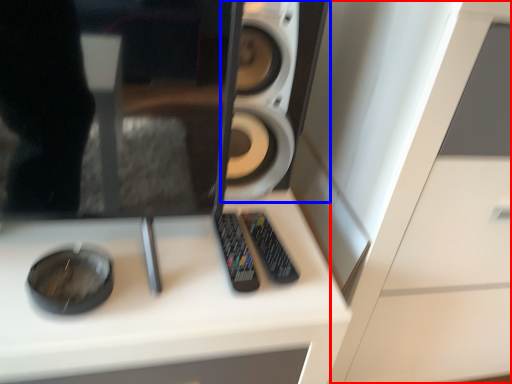
Question: Which object appears farthest to the camera in this image, dresser (highlighted by a red box) or speaker (highlighted by a blue box)?

Choices:
 (A) dresser
 (B) speaker

Answer: (B)